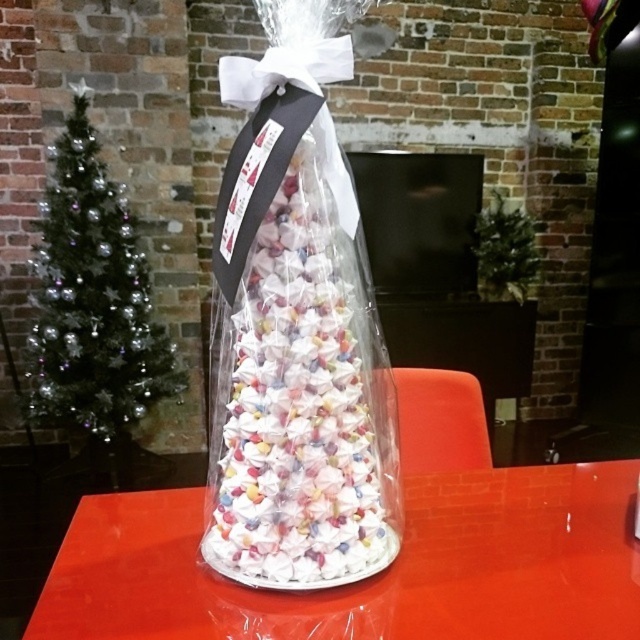
You are setting up a display and need to place a 6 inch wide decorative item between the translucent plastic table at center and the translucent paper cone at center. Is there enough space?

The distance between the translucent plastic table at center and the translucent paper cone at center is 5.54 inches, so there is not enough space to place a 6 inch wide decorative item between them.

You are setting up a display and need to place a 15 cm tall figurine on the translucent plastic table at center. Can the figurine fit on the table without touching the translucent paper cone at center?

The translucent plastic table at center is not as tall as the translucent paper cone at center. Therefore, the figurine placed on the translucent plastic table at center will not reach the height of the translucent paper cone at center, so it should fit without touching it.

You are setting up a display and need to place both the translucent plastic table at center and the translucent paper cone at center. Based on their sizes, which object should you place first to ensure they fit properly?

Since the translucent plastic table at center occupies less space than the translucent paper cone at center, you should place the translucent paper cone at center first to ensure there is enough space for both objects.